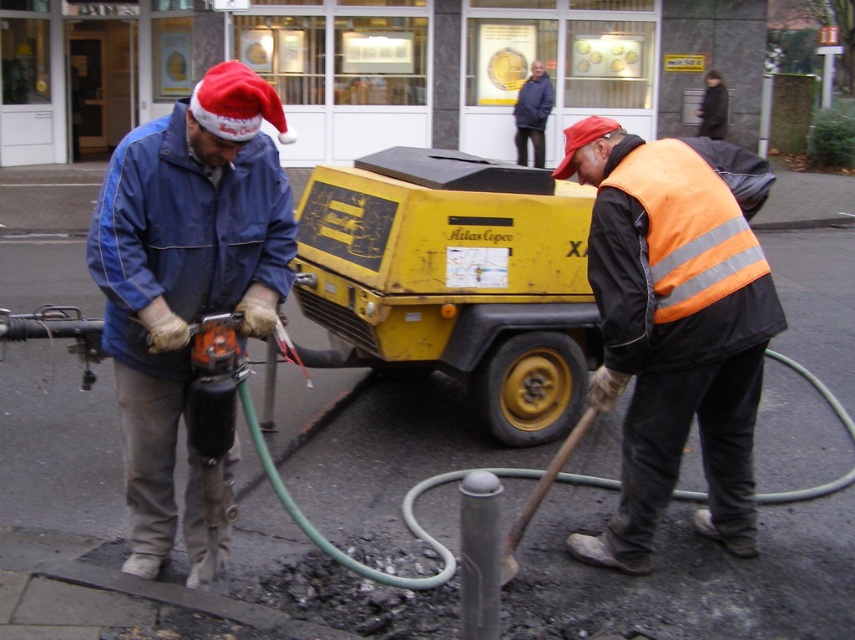
Question: Can you confirm if blue denim jacket at left is smaller than blue denim jacket at upper center?

Choices:
 (A) no
 (B) yes

Answer: (B)

Question: Can you confirm if orange reflective vest at center is smaller than blue denim jacket at upper center?

Choices:
 (A) yes
 (B) no

Answer: (B)

Question: Among these points, which one is farthest from the camera?

Choices:
 (A) (286, 268)
 (B) (535, 92)

Answer: (B)

Question: Can you confirm if orange reflective vest at center is bigger than blue denim jacket at upper center?

Choices:
 (A) yes
 (B) no

Answer: (A)

Question: Among these points, which one is nearest to the camera?

Choices:
 (A) (721, 212)
 (B) (540, 84)
 (C) (175, 200)
 (D) (628, 348)

Answer: (C)

Question: Which object is positioned closest to the blue denim jacket at upper center?

Choices:
 (A) blue denim jacket at left
 (B) orange reflective vest at center

Answer: (B)